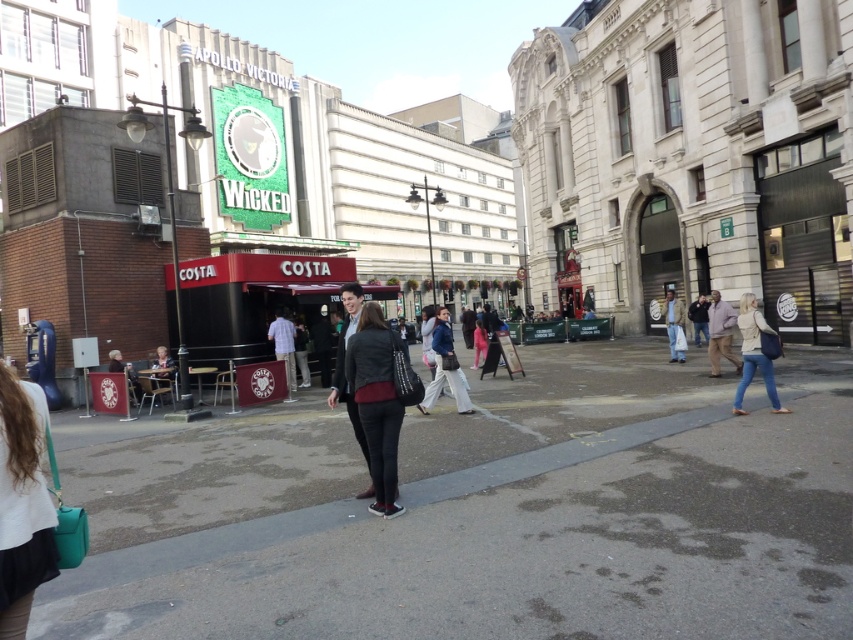
Can you confirm if light beige sweater at lower right is shorter than denim jacket at center?

Yes.

Is light beige sweater at lower right above denim jacket at center?

Yes, light beige sweater at lower right is above denim jacket at center.

Image resolution: width=853 pixels, height=640 pixels. I want to click on light beige sweater at lower right, so click(753, 353).

Find the location of `light beige sweater at lower right`. light beige sweater at lower right is located at coordinates (753, 353).

Who is positioned more to the left, gray asphalt pavement at center or light beige sweater at lower right?

gray asphalt pavement at center is more to the left.

Does gray asphalt pavement at center have a larger size compared to light beige sweater at lower right?

Yes.

The width and height of the screenshot is (853, 640). I want to click on gray asphalt pavement at center, so click(x=482, y=515).

Can you confirm if matte black costa coffee shop at center is positioned to the right of matte black jacket at center?

Indeed, matte black costa coffee shop at center is positioned on the right side of matte black jacket at center.

Identify the location of matte black costa coffee shop at center. (428, 177).

Who is more forward, (245, 154) or (395, 413)?

Point (395, 413) is in front.

The image size is (853, 640). I want to click on matte black costa coffee shop at center, so click(428, 177).